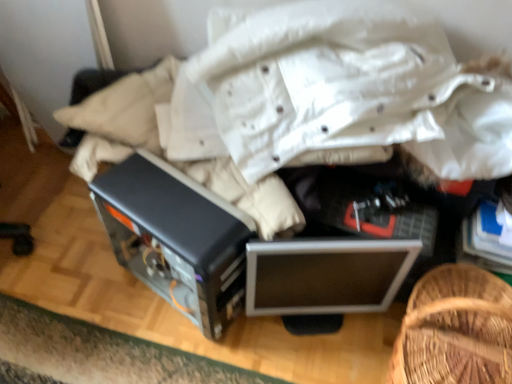
What do you see at coordinates (455, 329) in the screenshot?
I see `woven wood basket at lower right` at bounding box center [455, 329].

You are a GUI agent. You are given a task and a screenshot of the screen. Output one action in this format:
    pyautogui.click(x=<x>, y=<y>)
    Task: Click on the satin black computer case at center
    Image resolution: width=512 pixels, height=384 pixels.
    Given the screenshot: What is the action you would take?
    pyautogui.click(x=176, y=238)

Measure the distance between point (250, 260) and camera.

The depth of point (250, 260) is 38.54 inches.

This screenshot has width=512, height=384. Find the location of `woven wood basket at lower right`. woven wood basket at lower right is located at coordinates pyautogui.click(x=455, y=329).

Which is closer to the camera, (481, 362) or (210, 223)?

Point (481, 362) is positioned closer to the camera compared to point (210, 223).

From the image's perspective, which one is positioned higher, woven wood basket at lower right or satin black computer case at center?

satin black computer case at center, from the image's perspective.

Consider the image. Measure the distance from woven wood basket at lower right to satin black computer case at center.

The distance of woven wood basket at lower right from satin black computer case at center is 21.43 inches.

In order to click on furniture positioned vertically above the satin black computer case at center (from a real-world perspective) in this screenshot , I will do `click(455, 329)`.

Looking at this image, is satin black computer case at center directly adjacent to silver metallic monitor at center?

No, satin black computer case at center is not making contact with silver metallic monitor at center.

Is point (211, 234) closer or farther from the camera than point (265, 296)?

Point (211, 234) is closer to the camera than point (265, 296).

How far apart are satin black computer case at center and silver metallic monitor at center?

8.57 inches.

Considering the positions of point (287, 269) and point (484, 339), is point (287, 269) closer or farther from the camera than point (484, 339)?

Point (287, 269) is positioned farther from the camera compared to point (484, 339).

From the image's perspective, is silver metallic monitor at center under woven wood basket at lower right?

No.

Which is more to the right, silver metallic monitor at center or woven wood basket at lower right?

woven wood basket at lower right.

The height and width of the screenshot is (384, 512). What are the coordinates of `furniture on the right of silver metallic monitor at center` in the screenshot? It's located at (455, 329).

From the image's perspective, which is above, satin black computer case at center or woven wood basket at lower right?

satin black computer case at center, from the image's perspective.

How distant is satin black computer case at center from woven wood basket at lower right?

satin black computer case at center and woven wood basket at lower right are 54.44 centimeters apart.

The height and width of the screenshot is (384, 512). I want to click on appliance below the woven wood basket at lower right (from a real-world perspective), so tap(176, 238).

Is satin black computer case at center shorter than woven wood basket at lower right?

No, satin black computer case at center is not shorter than woven wood basket at lower right.

Based on the photo, are woven wood basket at lower right and silver metallic monitor at center beside each other?

No, woven wood basket at lower right is not with silver metallic monitor at center.

Is woven wood basket at lower right not inside silver metallic monitor at center?

That's correct, woven wood basket at lower right is outside of silver metallic monitor at center.

This screenshot has width=512, height=384. In order to click on computer located on the left of woven wood basket at lower right in this screenshot , I will do `click(326, 275)`.

Is woven wood basket at lower right smaller than silver metallic monitor at center?

No, woven wood basket at lower right is not smaller than silver metallic monitor at center.

From a real-world perspective, which is physically above, silver metallic monitor at center or satin black computer case at center?

satin black computer case at center, from a real-world perspective.

This screenshot has width=512, height=384. Identify the location of computer behind the satin black computer case at center. (326, 275).

In terms of width, does silver metallic monitor at center look wider or thinner when compared to satin black computer case at center?

Clearly, silver metallic monitor at center has less width compared to satin black computer case at center.

Is point (268, 306) in front of point (151, 236)?

That is False.

This screenshot has height=384, width=512. What are the coordinates of `appliance that is under the woven wood basket at lower right (from a real-world perspective)` in the screenshot? It's located at (176, 238).

This screenshot has width=512, height=384. Find the location of `appliance on the left side of silver metallic monitor at center`. appliance on the left side of silver metallic monitor at center is located at coordinates (176, 238).

Which object lies further to the anchor point silver metallic monitor at center, woven wood basket at lower right or satin black computer case at center?

satin black computer case at center is further to silver metallic monitor at center.

When comparing their distances from silver metallic monitor at center, does satin black computer case at center or woven wood basket at lower right seem closer?

woven wood basket at lower right is closer to silver metallic monitor at center.

Looking at the image, which one is located closer to woven wood basket at lower right, silver metallic monitor at center or satin black computer case at center?

silver metallic monitor at center.

In the scene shown: When comparing their distances from woven wood basket at lower right, does satin black computer case at center or silver metallic monitor at center seem closer?

silver metallic monitor at center is closer to woven wood basket at lower right.

From the image, which object appears to be farther from satin black computer case at center, silver metallic monitor at center or woven wood basket at lower right?

The object further to satin black computer case at center is woven wood basket at lower right.

Considering their positions, is woven wood basket at lower right positioned closer to satin black computer case at center than silver metallic monitor at center?

silver metallic monitor at center is closer to satin black computer case at center.

You are a GUI agent. You are given a task and a screenshot of the screen. Output one action in this format:
    pyautogui.click(x=<x>, y=<y>)
    Task: Click on the computer between satin black computer case at center and woven wood basket at lower right in the horizontal direction
    The image size is (512, 384).
    Given the screenshot: What is the action you would take?
    pyautogui.click(x=326, y=275)